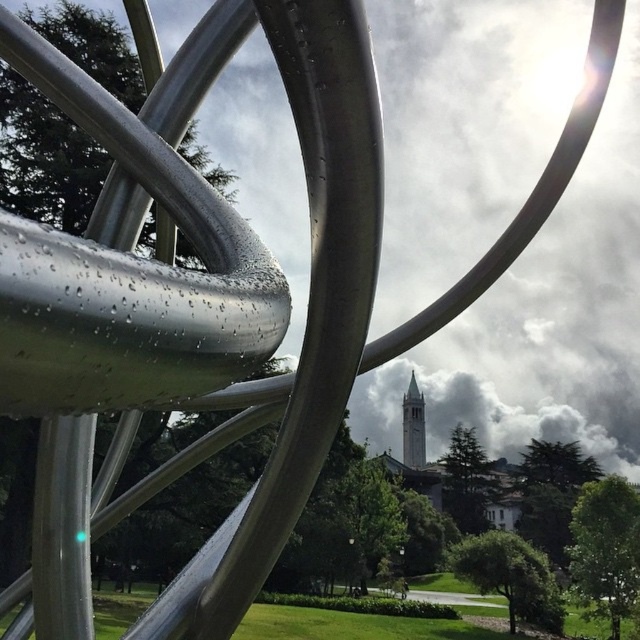
Question: Does metallic silver sculpture at center appear over gray stone bell tower at center?

Choices:
 (A) yes
 (B) no

Answer: (A)

Question: Which point appears closest to the camera in this image?

Choices:
 (A) (410, 385)
 (B) (148, 148)

Answer: (B)

Question: Which of the following is the closest to the observer?

Choices:
 (A) (417, 426)
 (B) (330, 406)

Answer: (B)

Question: Does metallic silver sculpture at center come behind gray stone bell tower at center?

Choices:
 (A) no
 (B) yes

Answer: (A)

Question: Which of the following is the closest to the observer?

Choices:
 (A) (404, 451)
 (B) (237, 394)

Answer: (B)

Question: Can you confirm if metallic silver sculpture at center is positioned above gray stone bell tower at center?

Choices:
 (A) no
 (B) yes

Answer: (B)